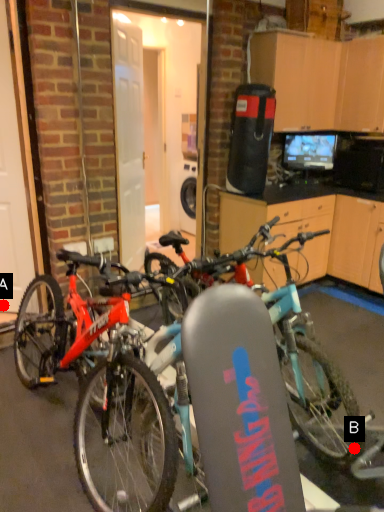
Question: Two points are circled on the image, labeled by A and B beside each circle. Which point is further to the camera?

Choices:
 (A) A is further
 (B) B is further

Answer: (A)